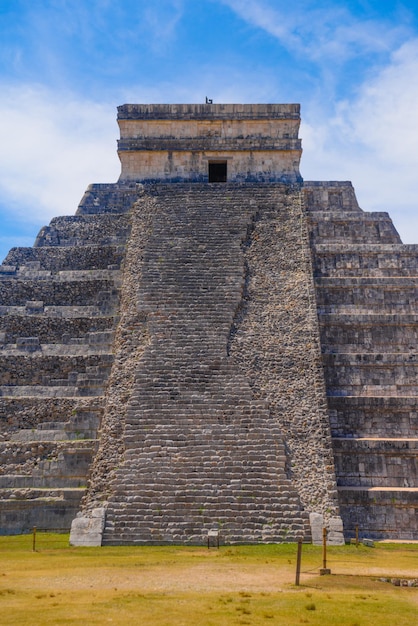
At what (x,y) coordinates should I click in order to perform the action: click on stone wall (right). Please return your answer as a coordinate pair (x, y). Looking at the image, I should click on (339, 225).